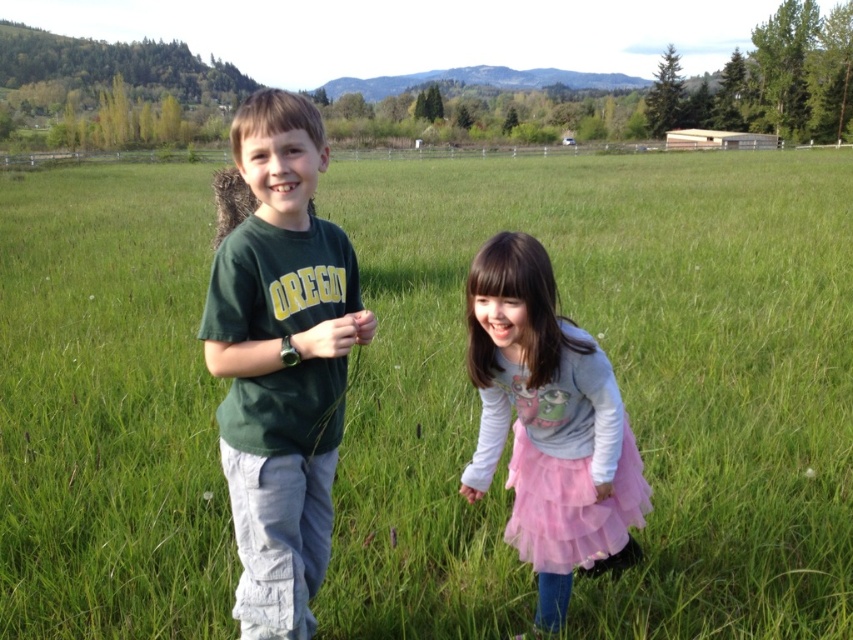
Question: Which point is farther to the camera?

Choices:
 (A) green cotton shirt at center
 (B) pink tulle skirt at lower center
 (C) pink tulle skirt at center

Answer: (B)

Question: Can you confirm if green cotton shirt at center is positioned to the right of pink tulle skirt at center?

Choices:
 (A) no
 (B) yes

Answer: (A)

Question: Which point appears farthest from the camera in this image?

Choices:
 (A) (621, 524)
 (B) (244, 243)
 (C) (575, 372)

Answer: (A)

Question: Which object appears closest to the camera in this image?

Choices:
 (A) pink tulle skirt at center
 (B) green cotton shirt at center

Answer: (B)

Question: Is pink tulle skirt at center positioned in front of pink tulle skirt at lower center?

Choices:
 (A) no
 (B) yes

Answer: (B)

Question: Can you confirm if green cotton shirt at center is thinner than pink tulle skirt at center?

Choices:
 (A) no
 (B) yes

Answer: (B)